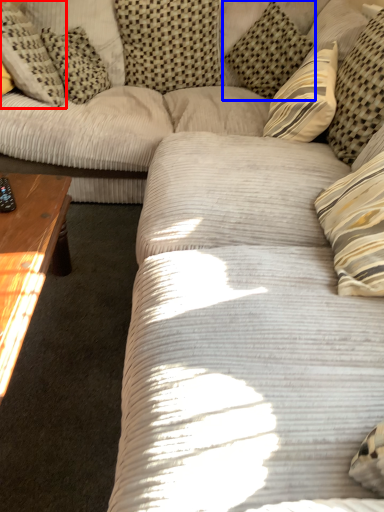
Question: Which object appears farthest to the camera in this image, pillow (highlighted by a red box) or pillow (highlighted by a blue box)?

Choices:
 (A) pillow
 (B) pillow

Answer: (B)